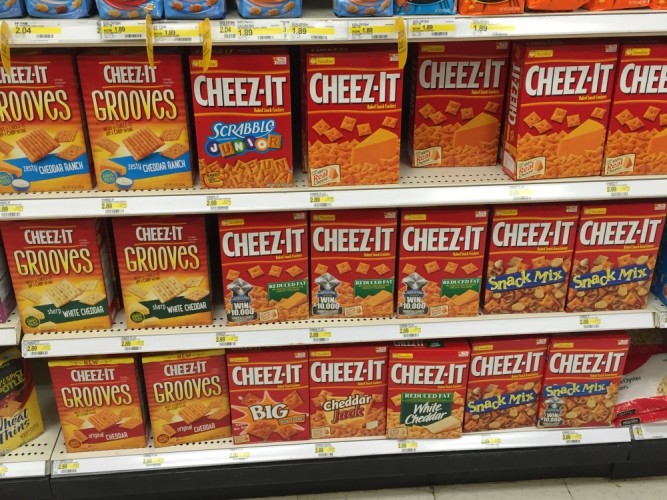
Where is `shelves`? shelves is located at coordinates (247, 32), (275, 199), (281, 336), (291, 449).